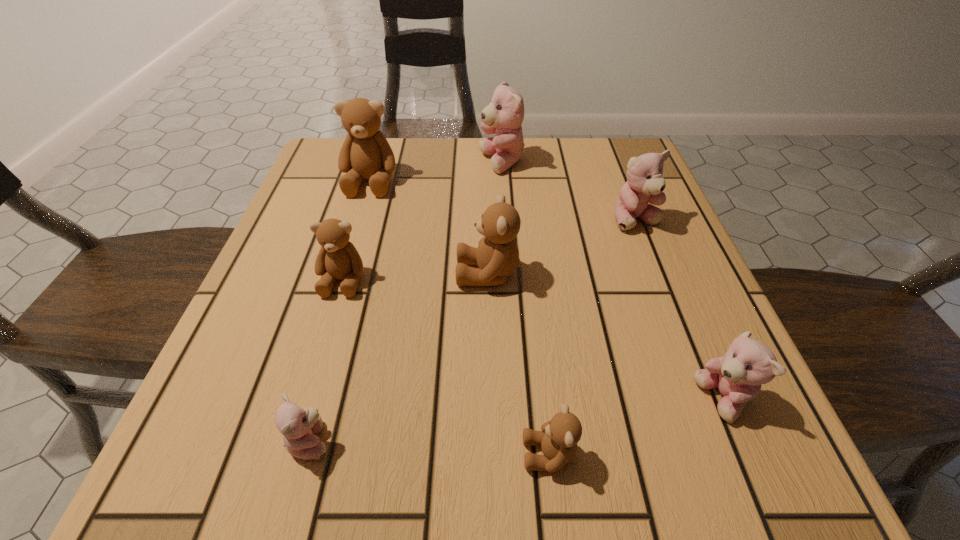
What are the coordinates of `vacant space situated 0.220m at the face of the farthest pink teddy bear` in the screenshot? It's located at (386, 163).

Locate an element on the screen. This screenshot has height=540, width=960. vacant space located 0.310m at the face of the farthest pink teddy bear is located at coordinates (348, 163).

Locate an element on the screen. free space located 0.100m at the face of the farthest pink teddy bear is located at coordinates (437, 163).

Identify the location of vacant space situated on the front-facing side of the farthest brown teddy bear. (335, 301).

The width and height of the screenshot is (960, 540). Find the location of `vacant area situated at the face of the second farthest pink teddy bear`. vacant area situated at the face of the second farthest pink teddy bear is located at coordinates (683, 339).

Where is `free space located 0.060m on the front-facing side of the third smallest brown teddy bear`? free space located 0.060m on the front-facing side of the third smallest brown teddy bear is located at coordinates (423, 273).

Locate an element on the screen. The width and height of the screenshot is (960, 540). vacant space located 0.070m on the front-facing side of the third smallest brown teddy bear is located at coordinates (418, 273).

Where is `free space located on the front-facing side of the third smallest brown teddy bear`? free space located on the front-facing side of the third smallest brown teddy bear is located at coordinates (396, 273).

Identify the location of vacant space located 0.170m on the front-facing side of the second smallest brown teddy bear. Image resolution: width=960 pixels, height=540 pixels. (311, 388).

This screenshot has width=960, height=540. In order to click on vacant space situated 0.300m at the face of the third biggest pink teddy bear in this screenshot , I will do [x=484, y=400].